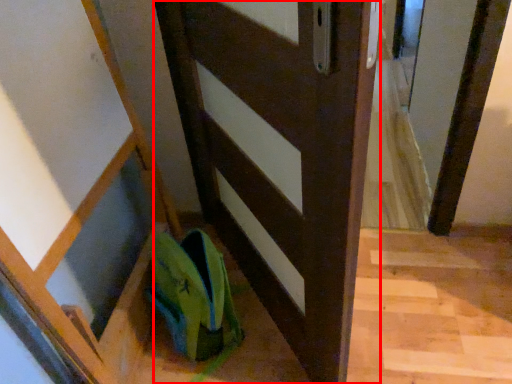
Question: From the image, what is the correct spatial relationship of door (annotated by the red box) in relation to shoe?

Choices:
 (A) right
 (B) left

Answer: (A)